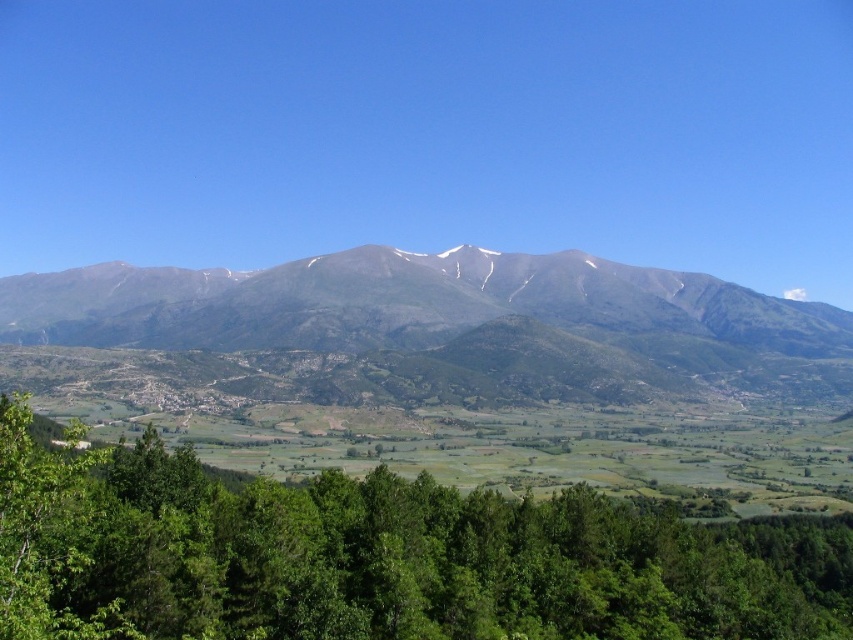
Can you confirm if green leafy tree at lower center is shorter than gray rocky mountain range at center?

Yes, green leafy tree at lower center is shorter than gray rocky mountain range at center.

What do you see at coordinates (378, 557) in the screenshot?
I see `green leafy tree at lower center` at bounding box center [378, 557].

Does point (285, 529) come closer to viewer compared to point (805, 314)?

Yes.

At what (x,y) coordinates should I click in order to perform the action: click on green leafy tree at lower center. Please return your answer as a coordinate pair (x, y). The image size is (853, 640). Looking at the image, I should click on (378, 557).